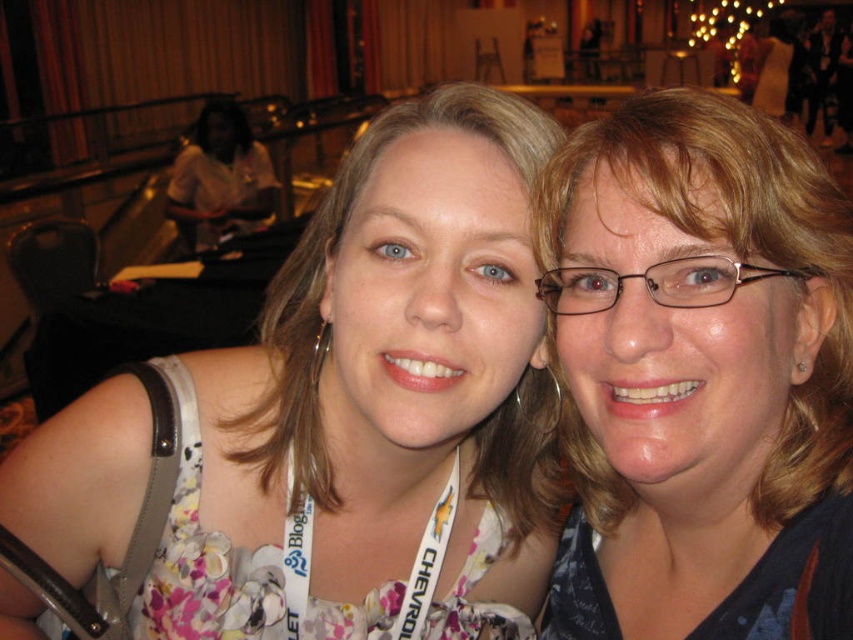
Where is `matte black glasses at center`? The width and height of the screenshot is (853, 640). matte black glasses at center is located at coordinates (700, 376).

Does point (614, 371) come in front of point (407, 604)?

Yes, it is in front of point (407, 604).

Between point (717, 237) and point (303, 547), which one is positioned in front?

Point (717, 237) is in front.

Locate an element on the screen. The image size is (853, 640). matte black glasses at center is located at coordinates (700, 376).

Can you confirm if floral fabric dress at center is wider than matte black glasses at center?

Indeed, floral fabric dress at center has a greater width compared to matte black glasses at center.

Measure the distance from floral fabric dress at center to matte black glasses at center.

They are 6.67 inches apart.

Is point (315, 262) positioned behind point (581, 572)?

That is True.

You are a GUI agent. You are given a task and a screenshot of the screen. Output one action in this format:
    pyautogui.click(x=<x>, y=<y>)
    Task: Click on the floral fabric dress at center
    The image size is (853, 640).
    Given the screenshot: What is the action you would take?
    pyautogui.click(x=334, y=419)

Does point (293, 278) lie behind point (302, 536)?

Yes, it is.

Can you confirm if floral fabric dress at center is bigger than white fabric lanyard at center?

Yes.

Describe the element at coordinates (334, 419) in the screenshot. I see `floral fabric dress at center` at that location.

This screenshot has height=640, width=853. What are the coordinates of `floral fabric dress at center` in the screenshot? It's located at (334, 419).